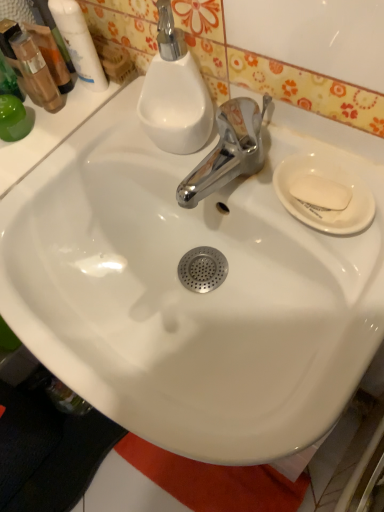
Question: Looking at the image, does translucent plastic mouthwash at upper left, the 1th mouthwash in the left-to-right sequence, seem bigger or smaller compared to white ceramic plate at right?

Choices:
 (A) big
 (B) small

Answer: (B)

Question: In the image, is translucent plastic mouthwash at upper left, the 1th mouthwash in the left-to-right sequence, positioned in front of or behind white ceramic plate at right?

Choices:
 (A) front
 (B) behind

Answer: (B)

Question: Estimate the real-world distances between objects in this image. Which object is farther from the white matte soap at right?

Choices:
 (A) white ceramic plate at right
 (B) translucent plastic mouthwash at upper left, the 1th mouthwash in the left-to-right sequence
 (C) white glossy mouthwash at upper left, acting as the second mouthwash starting from the left

Answer: (B)

Question: Which is farther from the white glossy mouthwash at upper left, which is counted as the first mouthwash, starting from the right?

Choices:
 (A) white ceramic plate at right
 (B) white matte soap at right
 (C) translucent plastic mouthwash at upper left, which is the second mouthwash in right-to-left order

Answer: (B)